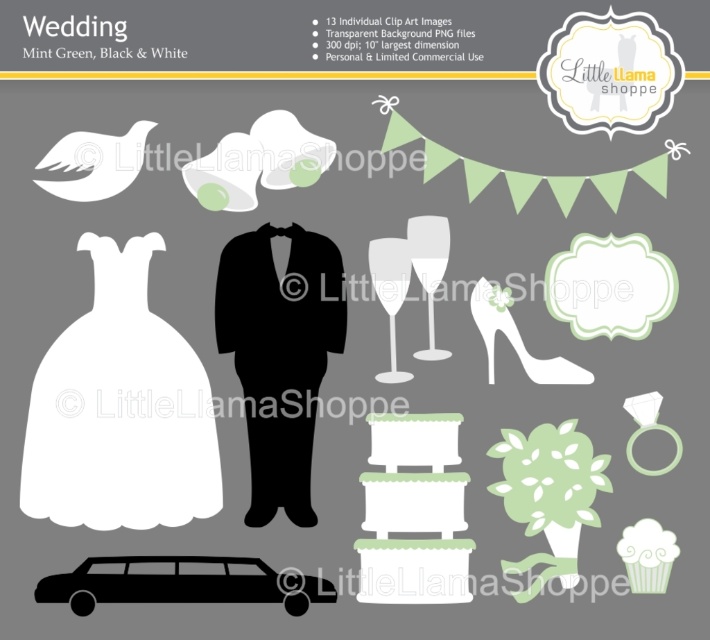
You are standing in front of the image and want to touch the point at coordinates [94,435]. Considering the distance from the camera, is this point closer to you or farther away compared to the other elements in the scene?

The point at coordinates [94,435] is 3.32 feet from the camera, so it is closer to you than the other elements in the scene.

You are planning a wedding and see the white matte dress at left and the black matte limousine at lower left in the image. Which object is taller?

The white matte dress at left is taller than the black matte limousine at lower left.

You are designing a wedding invitation and need to place the white matte dress at left and the black matte limousine at lower left. The invitation has a 10 inch width limit. Can both elements fit side by side horizontally without overlapping?

The distance between the white matte dress at left and the black matte limousine at lower left is 4.54 inches. Since the invitation allows up to 10 inches width, both elements can fit side by side horizontally without overlapping as their combined width is within the limit.